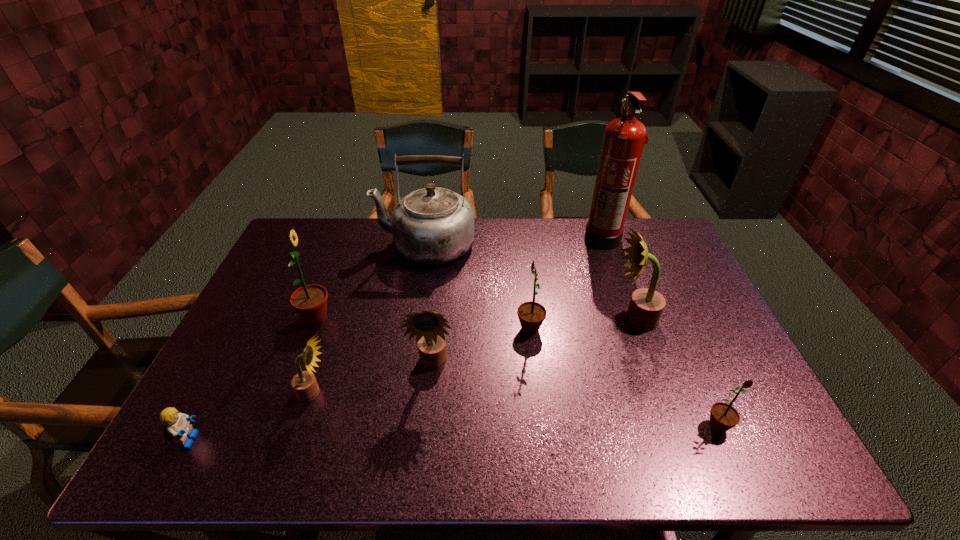
Find the location of `the rightmost green sunflower`. the rightmost green sunflower is located at coordinates (723, 416).

Identify the location of the nearest green sunflower. (723, 416).

At what (x,y) coordinates should I click in order to perform the action: click on the shortest object. Please return your answer as a coordinate pair (x, y). This screenshot has width=960, height=540. Looking at the image, I should click on (177, 426).

At what (x,y) coordinates should I click in order to perform the action: click on the leftmost object. Please return your answer as a coordinate pair (x, y). This screenshot has width=960, height=540. Looking at the image, I should click on (177, 426).

Locate an element on the screen. This screenshot has height=540, width=960. vacant space located with the nozzle pointing from the back of the fire extinguisher is located at coordinates (529, 238).

Where is `vacant point located 0.110m with the nozzle pointing from the back of the fire extinguisher`? Image resolution: width=960 pixels, height=540 pixels. vacant point located 0.110m with the nozzle pointing from the back of the fire extinguisher is located at coordinates (552, 238).

Find the location of a particular element. The height and width of the screenshot is (540, 960). blank space located 0.270m with the nozzle pointing from the back of the fire extinguisher is located at coordinates (506, 238).

Locate an element on the screen. vacant space located at the spout of the kettle is located at coordinates (349, 245).

Locate an element on the screen. free space located at the spout of the kettle is located at coordinates (340, 245).

You are a GUI agent. You are given a task and a screenshot of the screen. Output one action in this format:
    pyautogui.click(x=<x>, y=<y>)
    Task: Click on the vacant region located 0.290m at the spout of the kettle
    This screenshot has height=540, width=960.
    Given the screenshot: What is the action you would take?
    pyautogui.click(x=290, y=245)